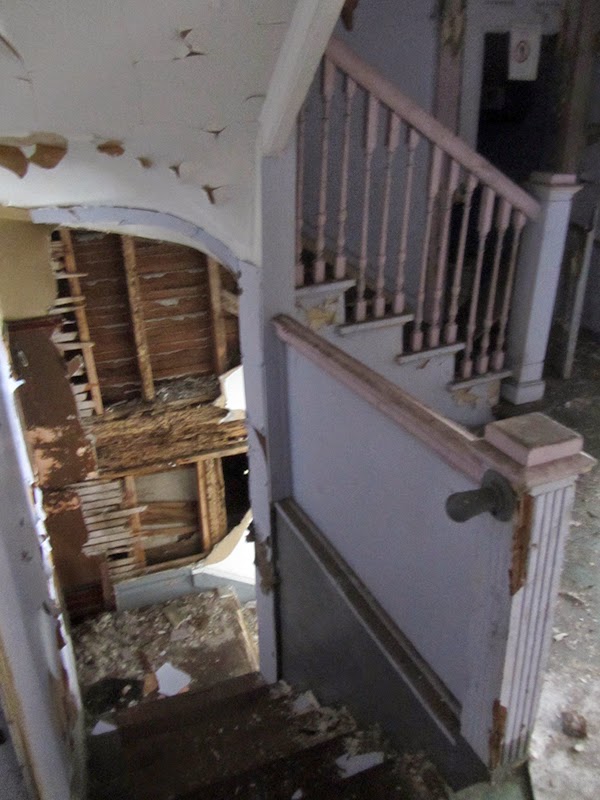
The image size is (600, 800). What are the coordinates of `drywall` in the screenshot? It's located at (222, 562).